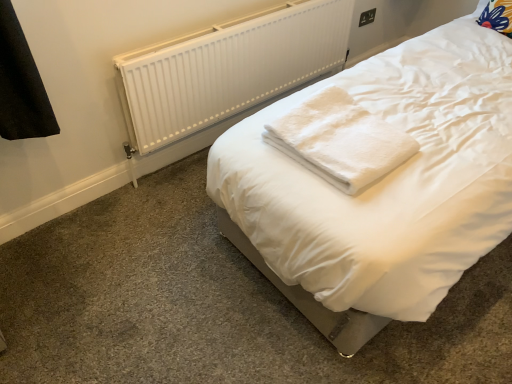
Question: Is white fluffy towel at center bigger than black plastic electric outlet at upper right?

Choices:
 (A) no
 (B) yes

Answer: (B)

Question: Is white fluffy towel at center at the left side of black plastic electric outlet at upper right?

Choices:
 (A) yes
 (B) no

Answer: (A)

Question: From the image's perspective, is white fluffy towel at center under black plastic electric outlet at upper right?

Choices:
 (A) yes
 (B) no

Answer: (A)

Question: Considering the relative sizes of white fluffy towel at center and black plastic electric outlet at upper right in the image provided, is white fluffy towel at center shorter than black plastic electric outlet at upper right?

Choices:
 (A) no
 (B) yes

Answer: (A)

Question: Is white fluffy towel at center thinner than black plastic electric outlet at upper right?

Choices:
 (A) yes
 (B) no

Answer: (B)

Question: From a real-world perspective, relative to white plastic radiator at upper center, is black plastic electric outlet at upper right vertically above or below?

Choices:
 (A) above
 (B) below

Answer: (A)

Question: Considering the relative positions of black plastic electric outlet at upper right and white plastic radiator at upper center in the image provided, is black plastic electric outlet at upper right to the left or to the right of white plastic radiator at upper center?

Choices:
 (A) right
 (B) left

Answer: (A)

Question: In the image, is black plastic electric outlet at upper right positioned in front of or behind white plastic radiator at upper center?

Choices:
 (A) behind
 (B) front

Answer: (A)

Question: Looking at their shapes, would you say black plastic electric outlet at upper right is wider or thinner than white plastic radiator at upper center?

Choices:
 (A) wide
 (B) thin

Answer: (B)

Question: In terms of height, does black plastic electric outlet at upper right look taller or shorter compared to white fluffy towel at center?

Choices:
 (A) tall
 (B) short

Answer: (B)

Question: Is black plastic electric outlet at upper right inside the boundaries of white fluffy towel at center, or outside?

Choices:
 (A) inside
 (B) outside

Answer: (B)

Question: Relative to white fluffy towel at center, is black plastic electric outlet at upper right in front or behind?

Choices:
 (A) front
 (B) behind

Answer: (B)

Question: From a real-world perspective, is black plastic electric outlet at upper right above or below white fluffy towel at center?

Choices:
 (A) below
 (B) above

Answer: (A)

Question: Considering the relative positions of white plastic radiator at upper center and black plastic electric outlet at upper right in the image provided, is white plastic radiator at upper center to the left or to the right of black plastic electric outlet at upper right?

Choices:
 (A) right
 (B) left

Answer: (B)

Question: Is point tap(207, 97) positioned closer to the camera than point tap(364, 21)?

Choices:
 (A) farther
 (B) closer

Answer: (B)